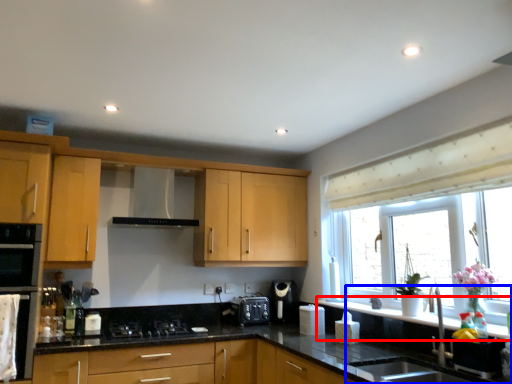
Question: Which object is further to the camera taking this photo, window sill (highlighted by a red box) or sink (highlighted by a blue box)?

Choices:
 (A) window sill
 (B) sink

Answer: (A)